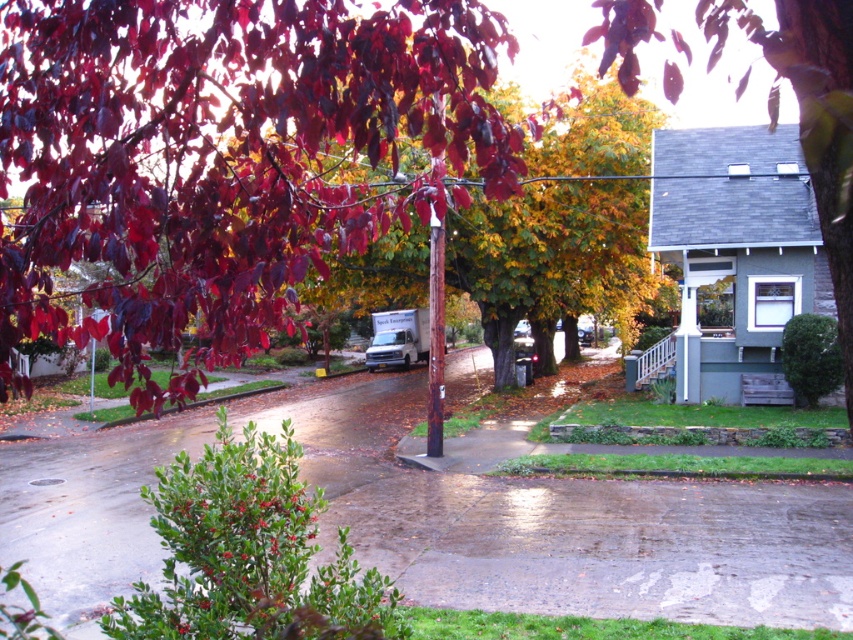
Question: Does shiny crimson leaves at upper left appear under green leafy tree at upper right?

Choices:
 (A) yes
 (B) no

Answer: (A)

Question: Does shiny crimson leaves at upper left come in front of green leafy tree at upper right?

Choices:
 (A) yes
 (B) no

Answer: (B)

Question: Does shiny crimson leaves at upper left have a lesser width compared to green leafy tree at upper right?

Choices:
 (A) yes
 (B) no

Answer: (A)

Question: Which of the following is the closest to the observer?

Choices:
 (A) green leafy tree at upper right
 (B) shiny crimson leaves at upper left

Answer: (A)

Question: Which point is closer to the camera taking this photo?

Choices:
 (A) (250, 182)
 (B) (833, 198)

Answer: (B)